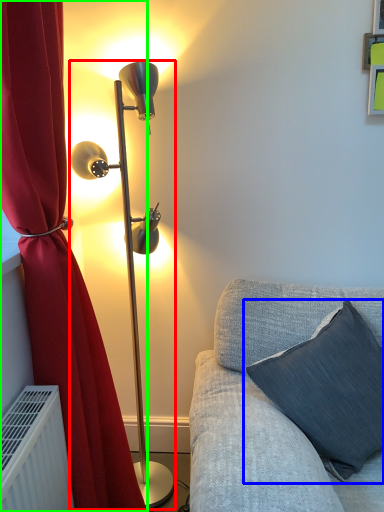
Question: Which is farther away from lamp (highlighted by a red box)? pillow (highlighted by a blue box) or curtain (highlighted by a green box)?

Choices:
 (A) pillow
 (B) curtain

Answer: (A)